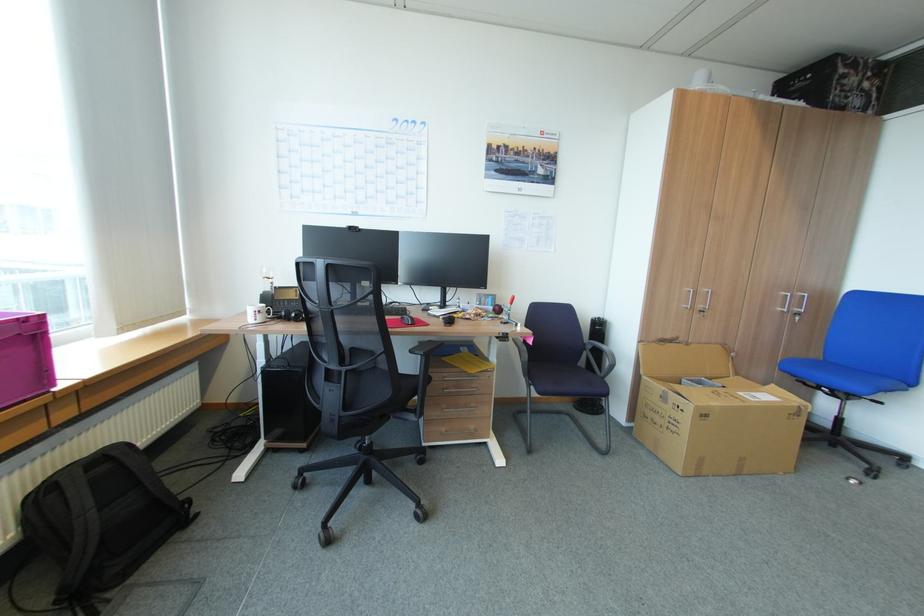
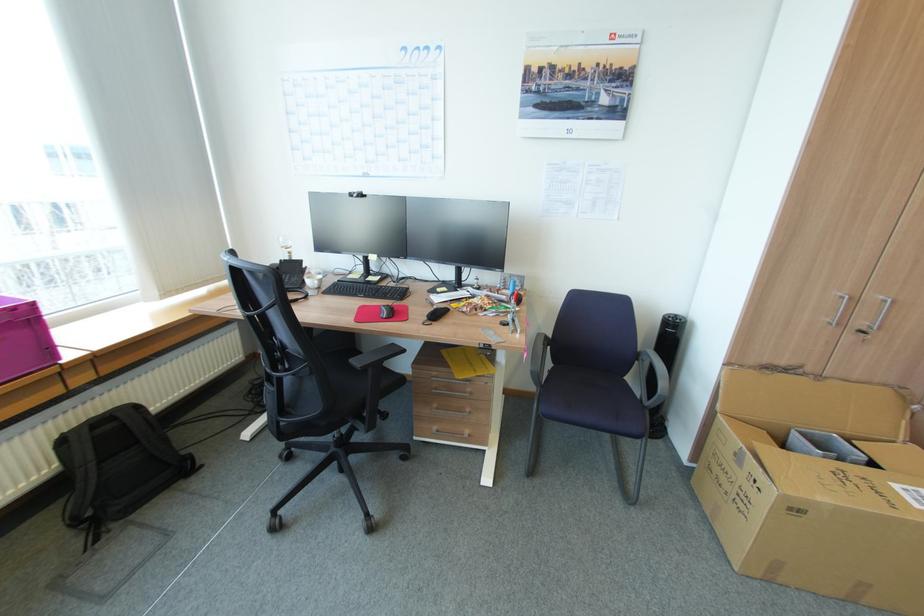
Where in the second image is the point corresponding to the point at 708,310 from the first image?

(868, 331)